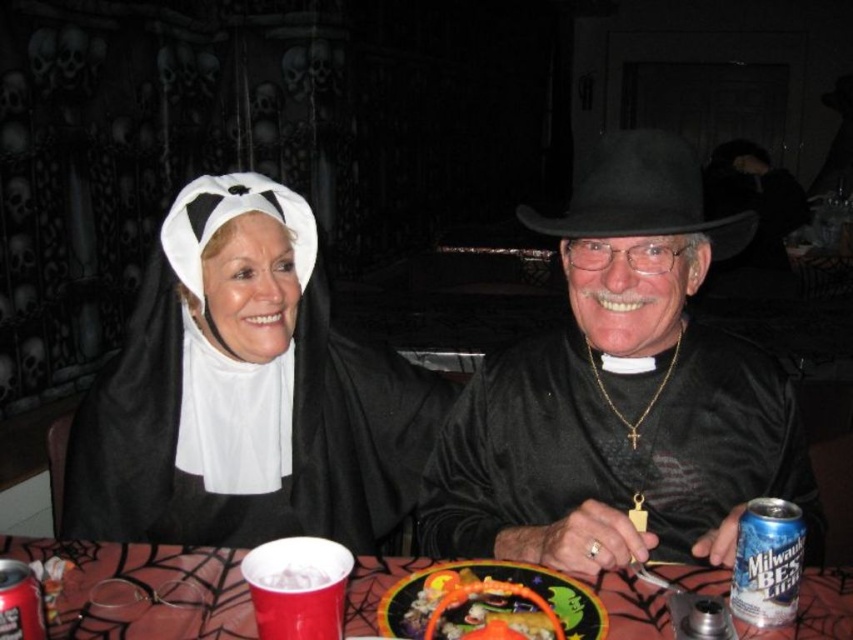
Who is lower down, black velvet hat at center or matte black nun costume at left?

black velvet hat at center is lower down.

Is point (682, 456) closer to camera compared to point (291, 422)?

Yes, point (682, 456) is closer to viewer.

Identify the location of black velvet hat at center. (619, 394).

Measure the distance between orange plastic basket at center and camera.

They are 28.37 inches apart.

Which is more to the right, orange plastic basket at center or silver metallic can at lower right?

Positioned to the right is silver metallic can at lower right.

Which is in front, point (440, 593) or point (751, 604)?

Point (751, 604)

Find the location of a particular element. The width and height of the screenshot is (853, 640). orange plastic basket at center is located at coordinates (479, 609).

Who is lower down, black velvet hat at center or spiderweb-patterned tablecloth at center?

Positioned lower is spiderweb-patterned tablecloth at center.

Between point (578, 451) and point (70, 605), which one is positioned in front?

Point (70, 605)

Identify the location of black velvet hat at center. Image resolution: width=853 pixels, height=640 pixels. (619, 394).